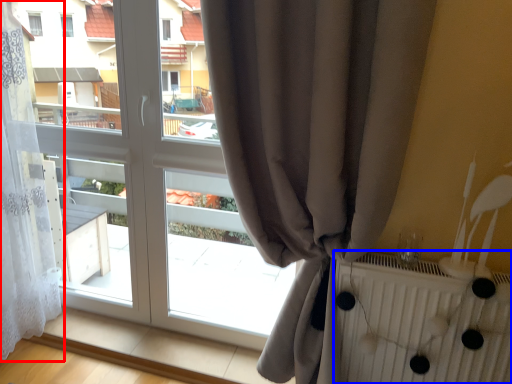
Question: Among these objects, which one is nearest to the camera, curtain (highlighted by a red box) or radiator (highlighted by a blue box)?

Choices:
 (A) curtain
 (B) radiator

Answer: (B)